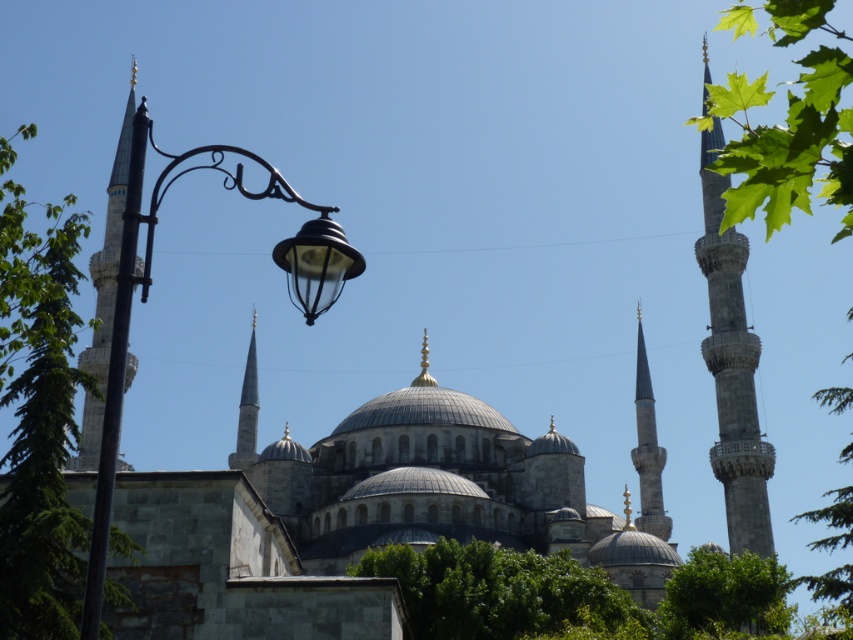
Is green leafy tree at lower right thinner than smooth stone minaret at left?

Yes.

Looking at this image, does green leafy tree at lower right have a smaller size compared to smooth stone minaret at left?

Indeed, green leafy tree at lower right has a smaller size compared to smooth stone minaret at left.

Is point (703, 616) closer to viewer compared to point (91, 465)?

Yes.

Find the location of a particular element. Image resolution: width=853 pixels, height=640 pixels. green leafy tree at lower right is located at coordinates (724, 596).

Is green leafy tree at left behind smooth stone minaret at center-right?

No, it is in front of smooth stone minaret at center-right.

Based on the photo, between green leafy tree at left and smooth stone minaret at center-right, which one is positioned lower?

smooth stone minaret at center-right is lower down.

The height and width of the screenshot is (640, 853). Find the location of `green leafy tree at left`. green leafy tree at left is located at coordinates click(x=42, y=440).

Find the location of a particular element. This screenshot has width=853, height=640. green leafy tree at left is located at coordinates (42, 440).

Who is shorter, green leafy tree at upper right or smooth stone minaret at center-left?

smooth stone minaret at center-left is shorter.

Describe the element at coordinates (788, 141) in the screenshot. I see `green leafy tree at upper right` at that location.

Identify the location of green leafy tree at upper right. The width and height of the screenshot is (853, 640). (788, 141).